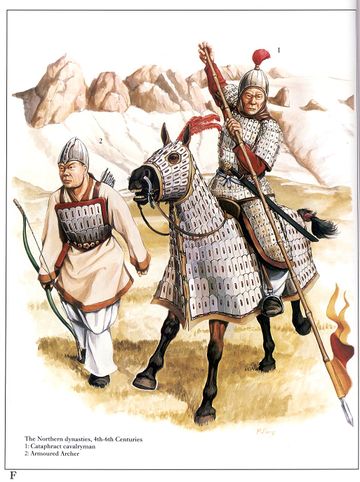
The width and height of the screenshot is (360, 482). In order to click on red tassles in this screenshot , I will do `click(200, 123)`.